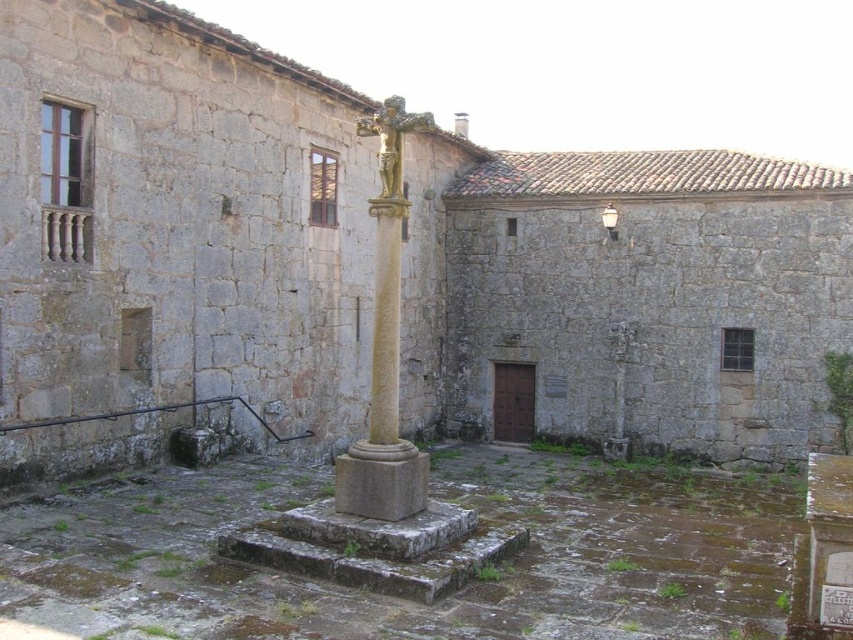
At what (x,y) coordinates should I click in order to perform the action: click on smooth stone cross at center. Please return your answer as a coordinate pair (x, y). Looking at the image, I should click on (386, 348).

Can you confirm if smooth stone cross at center is taller than white ceramic lamp post at upper center?

Indeed, smooth stone cross at center has a greater height compared to white ceramic lamp post at upper center.

Image resolution: width=853 pixels, height=640 pixels. What are the coordinates of `smooth stone cross at center` in the screenshot? It's located at (386, 348).